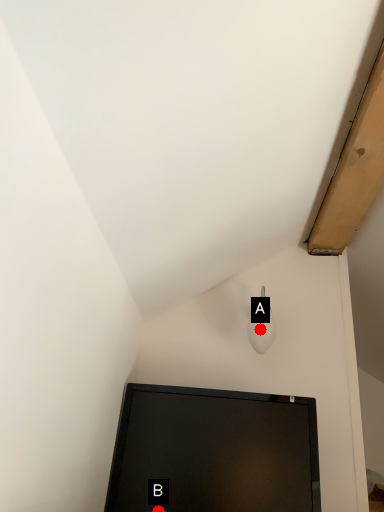
Question: Two points are circled on the image, labeled by A and B beside each circle. Which point is closer to the camera?

Choices:
 (A) A is closer
 (B) B is closer

Answer: (B)